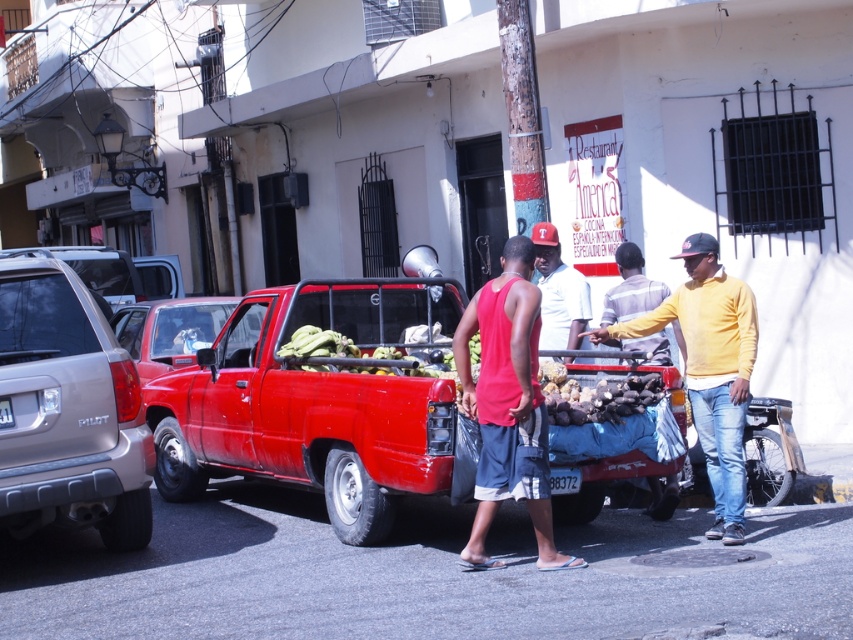
Question: Does matte silver suv at left appear under metallic red truck at center?

Choices:
 (A) no
 (B) yes

Answer: (B)

Question: Is yellow matte sweater at center closer to the viewer compared to matte white shirt at center?

Choices:
 (A) no
 (B) yes

Answer: (B)

Question: Which point is farther to the camera?

Choices:
 (A) metallic red truck at center
 (B) matte silver suv at left
 (C) shiny red truck at center

Answer: (A)

Question: Considering the real-world distances, which object is closest to the metallic red truck at center?

Choices:
 (A) red matte tank top at center
 (B) yellow matte sweater at center

Answer: (A)

Question: Which point is closer to the camera?

Choices:
 (A) metallic red truck at center
 (B) shiny red truck at center
 (C) matte white shirt at center

Answer: (B)

Question: Is matte silver suv at left to the right of metallic red truck at center from the viewer's perspective?

Choices:
 (A) yes
 (B) no

Answer: (A)